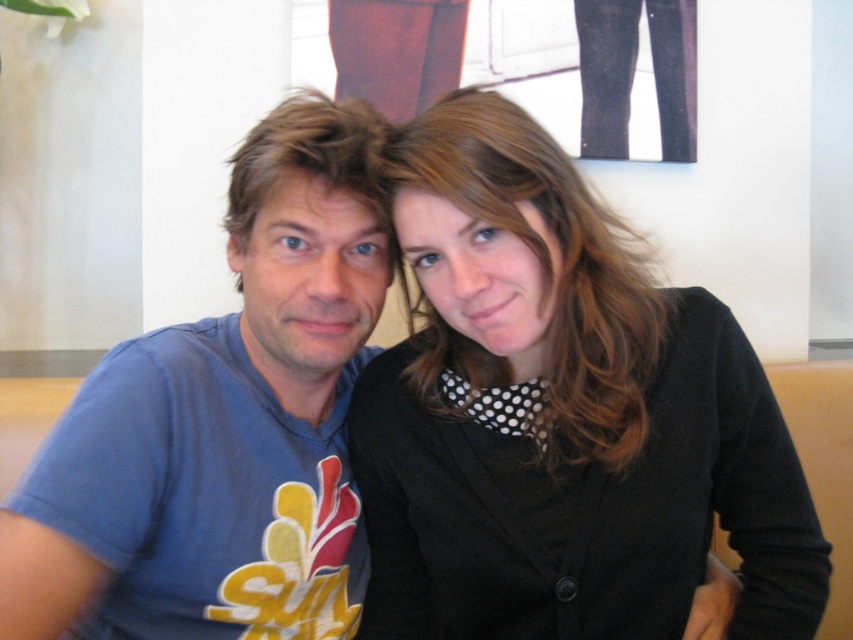
Who is more distant from viewer, (566, 344) or (291, 124)?

Positioned behind is point (291, 124).

The width and height of the screenshot is (853, 640). Identify the location of brownsmoothhair at center. (549, 268).

Who is taller, black matte cardigan at center or brownsmoothhair at center?

black matte cardigan at center is taller.

Is the position of black matte cardigan at center more distant than that of brownsmoothhair at center?

Yes, it is behind brownsmoothhair at center.

This screenshot has height=640, width=853. What do you see at coordinates (561, 416) in the screenshot? I see `black matte cardigan at center` at bounding box center [561, 416].

Identify the location of black matte cardigan at center. (561, 416).

Which is below, blue cotton t-shirt at left or brownsmoothhair at center?

blue cotton t-shirt at left

Which of these two, blue cotton t-shirt at left or brownsmoothhair at center, stands taller?

With more height is blue cotton t-shirt at left.

Is point (196, 326) farther from viewer compared to point (466, 129)?

That is True.

At what (x,y) coordinates should I click in order to perform the action: click on blue cotton t-shirt at left. Please return your answer as a coordinate pair (x, y). Looking at the image, I should click on (222, 426).